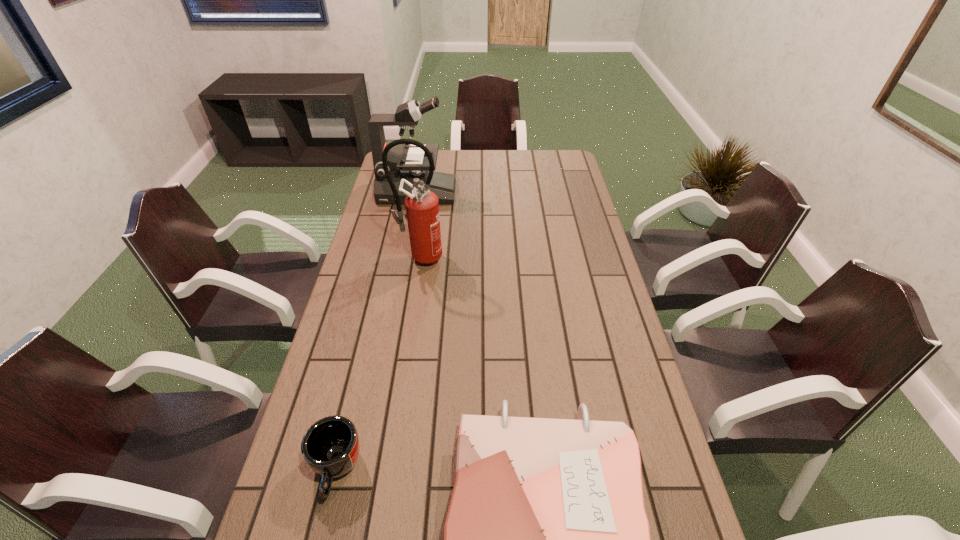
Identify the location of free space between the mug and the microscope. Image resolution: width=960 pixels, height=540 pixels. (376, 330).

Identify the location of free space between the fire extinguisher and the mug. The width and height of the screenshot is (960, 540). 378,363.

Choose which object is the second nearest neighbor to the phonebook. Please provide its 2D coordinates. Your answer should be formatted as a tuple, i.e. [(x, y)], where the tuple contains the x and y coordinates of a point satisfying the conditions above.

[(422, 205)]

The image size is (960, 540). I want to click on the closest object to the mug, so point(546,539).